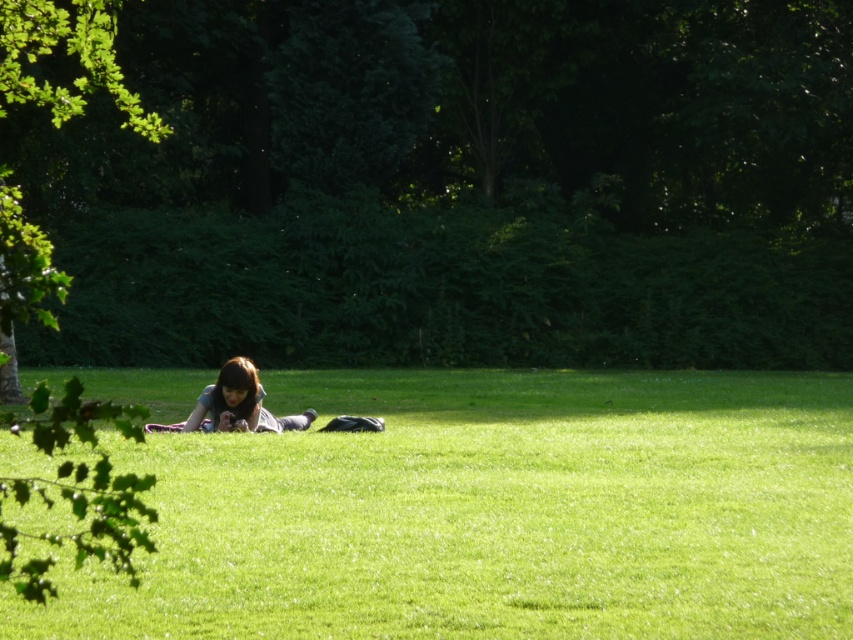
Can you confirm if green grass at center is positioned below dark brown hair at center?

Indeed, green grass at center is positioned under dark brown hair at center.

Is green grass at center smaller than dark brown hair at center?

No, green grass at center is not smaller than dark brown hair at center.

Describe the element at coordinates (492, 513) in the screenshot. The image size is (853, 640). I see `green grass at center` at that location.

Locate an element on the screen. Image resolution: width=853 pixels, height=640 pixels. green grass at center is located at coordinates tap(492, 513).